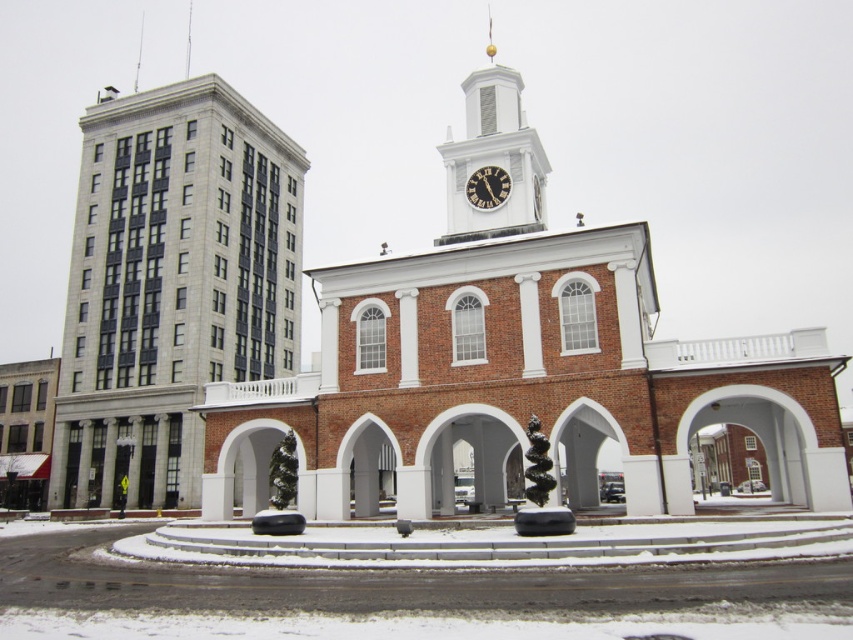
You are a tourist in the town square and want to take a photo of both the brick building at center and the white painted wood clock tower at upper center. Which building should you position yourself to the left of to capture both in your shot?

To capture both the brick building at center and the white painted wood clock tower at upper center in your photo, you should position yourself to the left of the brick building at center since the brick building at center is to the right of the white painted wood clock tower at upper center.

You are an architect evaluating the town square layout. You need to place a new statue exactly between the brick building at center and the black glossy clock at center. Which object will the statue be closer to, and why?

The statue will be closer to the black glossy clock at center because the brick building at center is larger in size than the black glossy clock at center, meaning the distance between them is determined by the size difference, so the midpoint would be nearer to the smaller object.